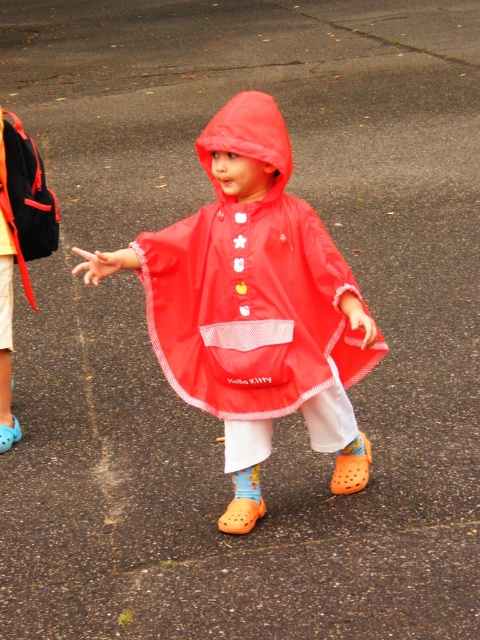
You are a photographer trying to capture a photo of the matte red raincoat at center and the matte black backpack at left. If you want to ensure both objects are in focus, which one should you adjust your camera focus on first?

The matte red raincoat at center is larger in size than the matte black backpack at left, so you should focus on the matte red raincoat at center first to ensure proper focus on the larger object.

You are a photographer trying to capture a clear shot of the matte red raincoat at center and the matte black backpack at left. Since you want both items in focus, you need to adjust your camera settings. Which object should you focus on to ensure both are sharp?

You should focus on the matte black backpack at left because it is further away from the viewer than the matte red raincoat at center. By focusing on the farther object, you can maximize the depth of field to include both items in sharp focus.

You are a photographer setting up a shoot in a parking lot. You have a matte red raincoat at center and a matte black backpack at left. The client wants to know if the raincoat can fit inside the backpack. Based on the scene description, can you confirm if the raincoat is wider than the backpack?

The matte red raincoat at center is wider than the matte black backpack at left, so the raincoat cannot fit inside the backpack.